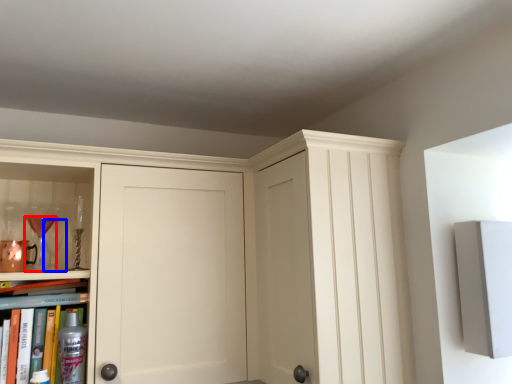
Question: Among these objects, which one is farthest to the camera, wine glass (highlighted by a red box) or wine glass (highlighted by a blue box)?

Choices:
 (A) wine glass
 (B) wine glass

Answer: (B)